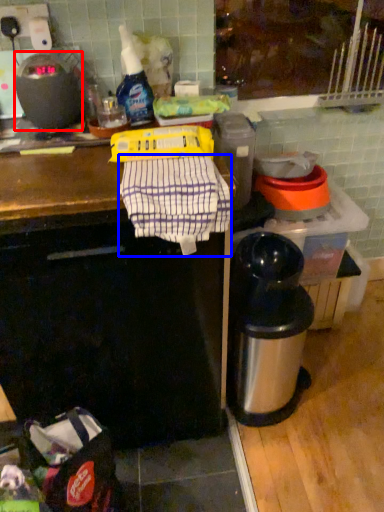
Question: Which object appears farthest to the camera in this image, kitchen appliance (highlighted by a red box) or laundry (highlighted by a blue box)?

Choices:
 (A) kitchen appliance
 (B) laundry

Answer: (A)